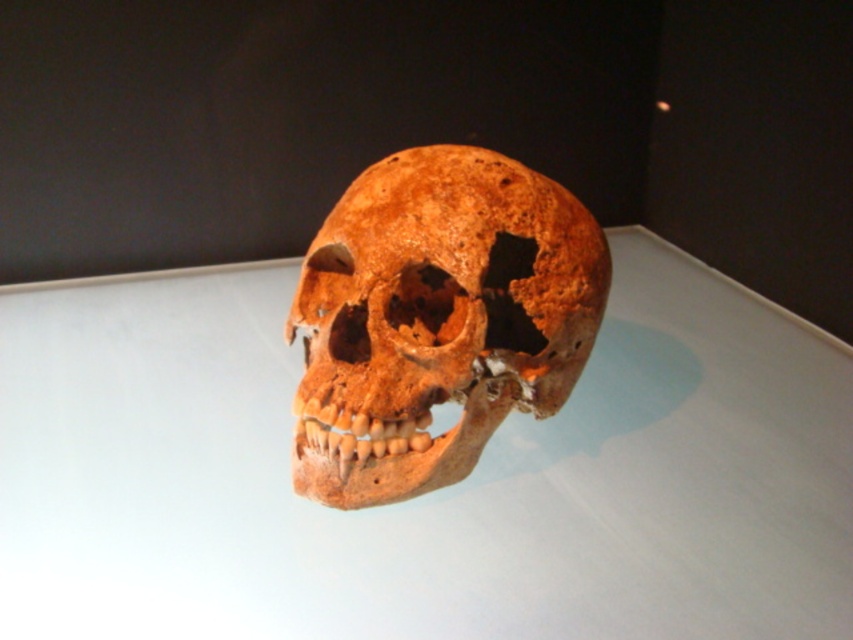
Is point (424, 564) positioned in front of point (415, 273)?

No, it is not.

Can you confirm if white glossy table at center is wider than brown matte skull at center?

Yes.

The height and width of the screenshot is (640, 853). Describe the element at coordinates (427, 493) in the screenshot. I see `white glossy table at center` at that location.

You are a GUI agent. You are given a task and a screenshot of the screen. Output one action in this format:
    pyautogui.click(x=<x>, y=<y>)
    Task: Click on the white glossy table at center
    
    Given the screenshot: What is the action you would take?
    pyautogui.click(x=427, y=493)